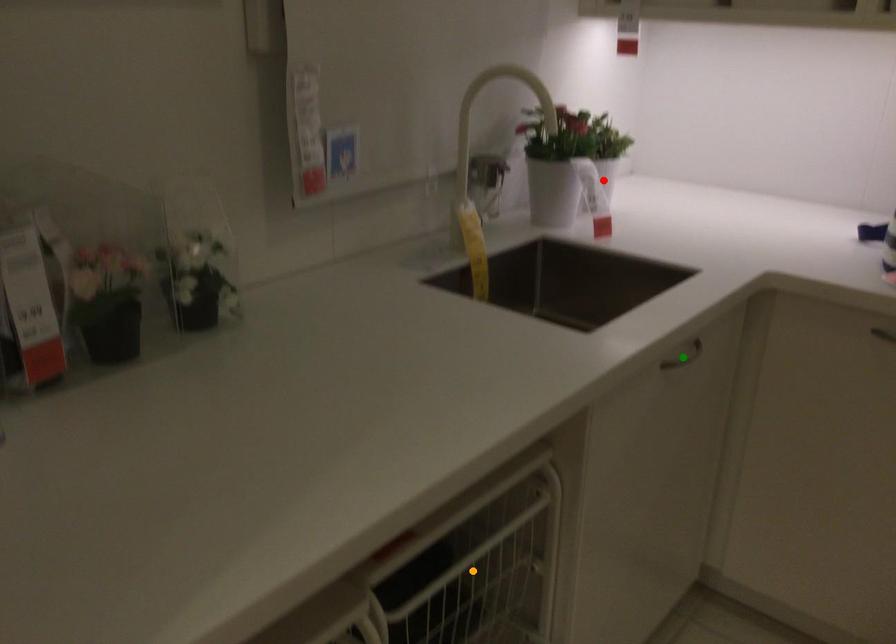
Order these from nearest to farthest:
- green point
- orange point
- red point

1. orange point
2. green point
3. red point